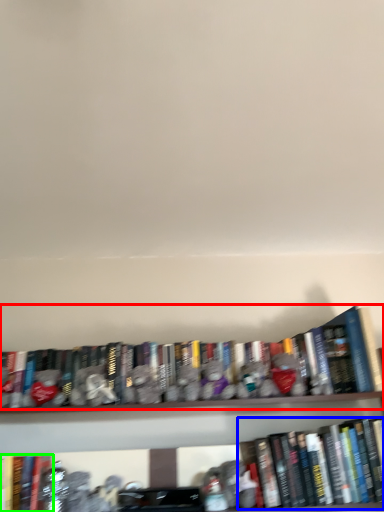
Question: Which is nearer to the book (highlighted by a red box)? book (highlighted by a blue box) or book (highlighted by a green box).

Choices:
 (A) book
 (B) book

Answer: (A)